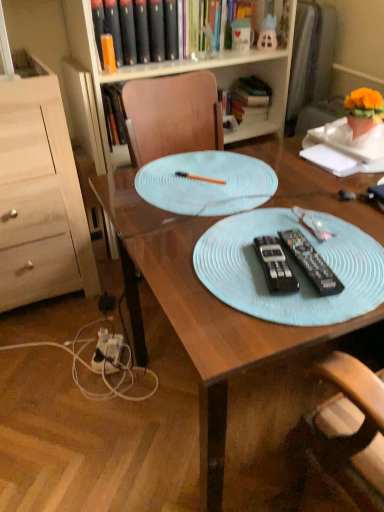
The width and height of the screenshot is (384, 512). I want to click on free spot above light blue textured placemat at upper center (from a real-world perspective), so click(x=205, y=176).